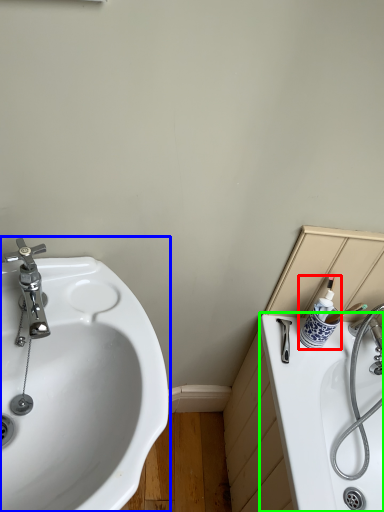
Question: Estimate the real-world distances between objects in this image. Which object is farther from toiletry (highlighted by a red box), sink (highlighted by a blue box) or bath (highlighted by a green box)?

Choices:
 (A) sink
 (B) bath

Answer: (A)